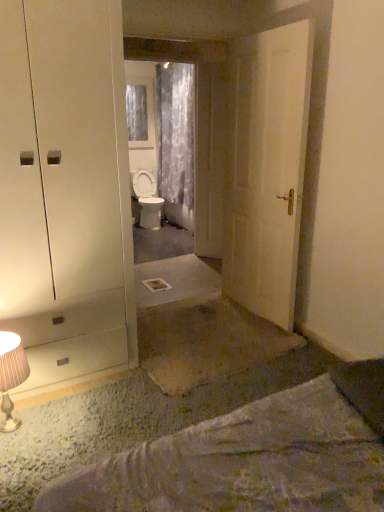
Question: Should I look upward or downward to see metallic beige table lamp at lower left?

Choices:
 (A) down
 (B) up

Answer: (A)

Question: Could you tell me if translucent floral fabric curtain at center is turned towards white glossy toilet at center?

Choices:
 (A) no
 (B) yes

Answer: (B)

Question: Is translucent floral fabric curtain at center completely or partially outside of white glossy toilet at center?

Choices:
 (A) no
 (B) yes

Answer: (B)

Question: Can white glossy toilet at center be found inside translucent floral fabric curtain at center?

Choices:
 (A) no
 (B) yes

Answer: (A)

Question: Is translucent floral fabric curtain at center bigger than white glossy toilet at center?

Choices:
 (A) no
 (B) yes

Answer: (B)

Question: Can you confirm if translucent floral fabric curtain at center is smaller than white glossy toilet at center?

Choices:
 (A) no
 (B) yes

Answer: (A)

Question: Is translucent floral fabric curtain at center positioned before white glossy toilet at center?

Choices:
 (A) yes
 (B) no

Answer: (A)

Question: Is white glossy toilet at center bigger than wooden door at center, arranged as the 1th door when viewed from the left?

Choices:
 (A) yes
 (B) no

Answer: (A)

Question: Can we say white glossy toilet at center lies outside wooden door at center, arranged as the 1th door when viewed from the left?

Choices:
 (A) no
 (B) yes

Answer: (B)

Question: Is white glossy toilet at center smaller than wooden door at center, placed as the second door when sorted from right to left?

Choices:
 (A) yes
 (B) no

Answer: (B)

Question: From the image's perspective, is white glossy toilet at center beneath wooden door at center, placed as the second door when sorted from right to left?

Choices:
 (A) no
 (B) yes

Answer: (B)

Question: From a real-world perspective, is white glossy toilet at center physically above wooden door at center, marked as the 1th door in a back-to-front arrangement?

Choices:
 (A) yes
 (B) no

Answer: (B)

Question: Is wooden door at center, placed as the second door when sorted from right to left, inside white glossy toilet at center?

Choices:
 (A) yes
 (B) no

Answer: (B)

Question: From the image's perspective, is transparent glass mirror at center under translucent floral fabric curtain at center?

Choices:
 (A) no
 (B) yes

Answer: (B)